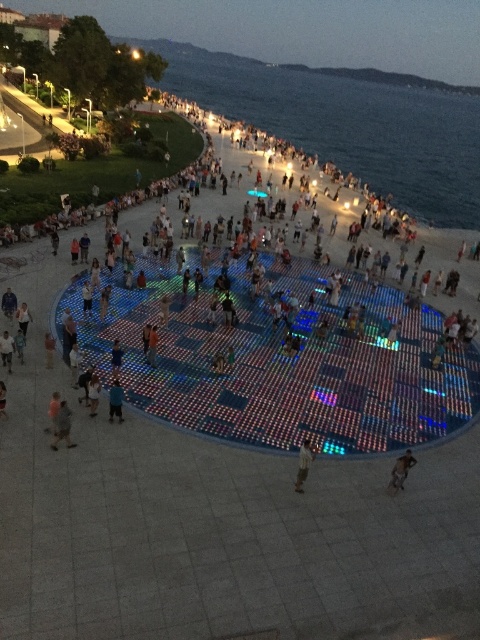
Question: Is blue water at center positioned before light brown fabric pants at center?

Choices:
 (A) no
 (B) yes

Answer: (A)

Question: Does blue water at center appear on the left side of dark blue shirt at center?

Choices:
 (A) yes
 (B) no

Answer: (B)

Question: Estimate the real-world distances between objects in this image. Which object is farther from the light brown fabric pants at center?

Choices:
 (A) blue water at center
 (B) dark blue shirt at center

Answer: (A)

Question: Is brown leather jacket at center in front of dark blue shirt at center?

Choices:
 (A) yes
 (B) no

Answer: (A)

Question: Among these points, which one is farthest from the camera?

Choices:
 (A) (58, 440)
 (B) (320, 138)

Answer: (B)

Question: Which of the following is the closest to the observer?

Choices:
 (A) (108, 392)
 (B) (339, 100)
 (C) (405, 472)

Answer: (C)